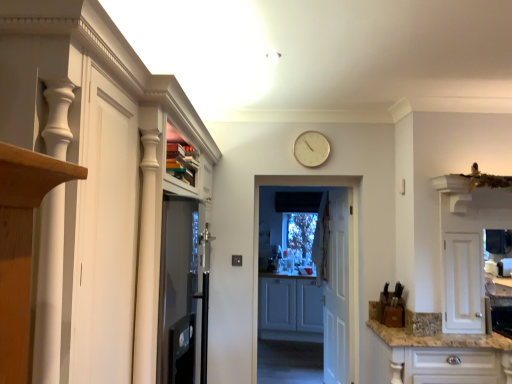
Question: Relative to white glossy cabinet at left, the first cabinetry in the left-to-right sequence, is white plastic clock at upper center in front or behind?

Choices:
 (A) behind
 (B) front

Answer: (A)

Question: Is white plastic clock at upper center bigger or smaller than white glossy cabinet at left, the 1th cabinetry in the front-to-back sequence?

Choices:
 (A) big
 (B) small

Answer: (B)

Question: Considering the real-world distances, which object is closest to the white wooden door at center, which appears as the first door when viewed from the right?

Choices:
 (A) white plastic clock at upper center
 (B) white glossy cabinet at left, arranged as the third cabinetry when viewed from the right
 (C) matte gray cabinets at center, placed as the 2th cabinetry when sorted from right to left
 (D) white wooden door at center, which ranks as the second door in right-to-left order
 (E) white glossy cabinet at lower right, positioned as the second cabinetry in front-to-back order

Answer: (D)

Question: Considering the real-world distances, which object is farthest from the white wooden door at center, which is counted as the second door, starting from the front?

Choices:
 (A) white wooden door at center, which is the first door from front to back
 (B) matte gray cabinets at center, placed as the first cabinetry when sorted from back to front
 (C) white glossy cabinet at left, which is the 3th cabinetry in back-to-front order
 (D) white glossy cabinet at lower right, which is the 1th cabinetry from right to left
 (E) white plastic clock at upper center

Answer: (C)